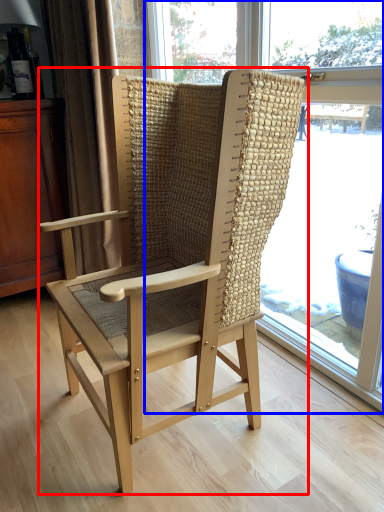
Question: Which object is further to the camera taking this photo, chair (highlighted by a red box) or window (highlighted by a blue box)?

Choices:
 (A) chair
 (B) window

Answer: (B)